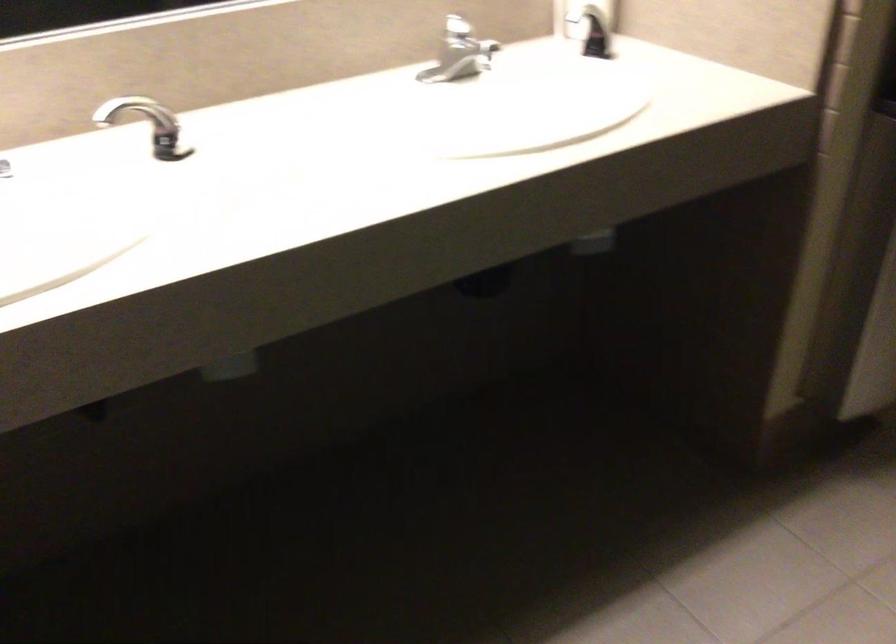
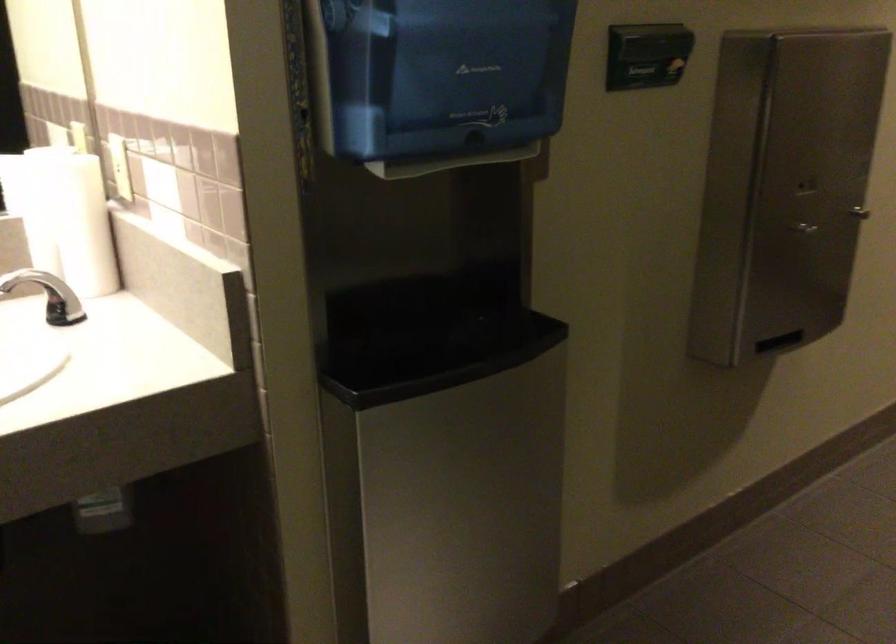
Question: The first image is from the beginning of the video and the second image is from the end. How did the camera likely rotate when shooting the video?

Choices:
 (A) Left
 (B) Right
 (C) Up
 (D) Down

Answer: (C)